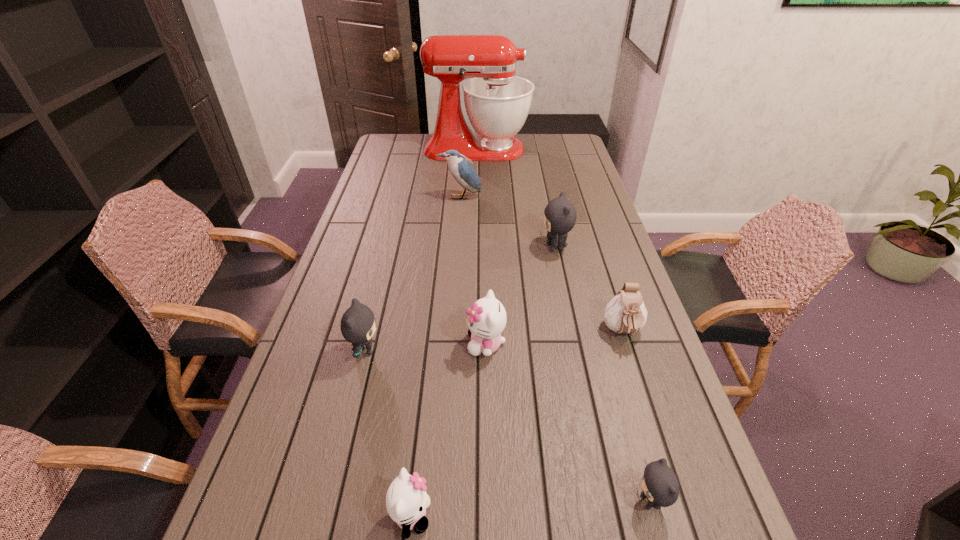
The height and width of the screenshot is (540, 960). I want to click on the fifth closest kitten to the pouch, so click(x=357, y=325).

The image size is (960, 540). Identify the location of the second closest gray kitten to the leftmost kitten. (660, 486).

This screenshot has height=540, width=960. Find the location of `gray kitten object that ranks as the third closest to the white pouch`. gray kitten object that ranks as the third closest to the white pouch is located at coordinates (357, 325).

The width and height of the screenshot is (960, 540). I want to click on blank space that satisfies the following two spatial constraints: 1. at the tip of the bird's beak; 2. on the front-facing side of the second nearest gray kitten, so click(450, 350).

The height and width of the screenshot is (540, 960). I want to click on vacant point that satisfies the following two spatial constraints: 1. on the front-facing side of the white pouch; 2. on the front-facing side of the nearest gray kitten, so click(x=677, y=501).